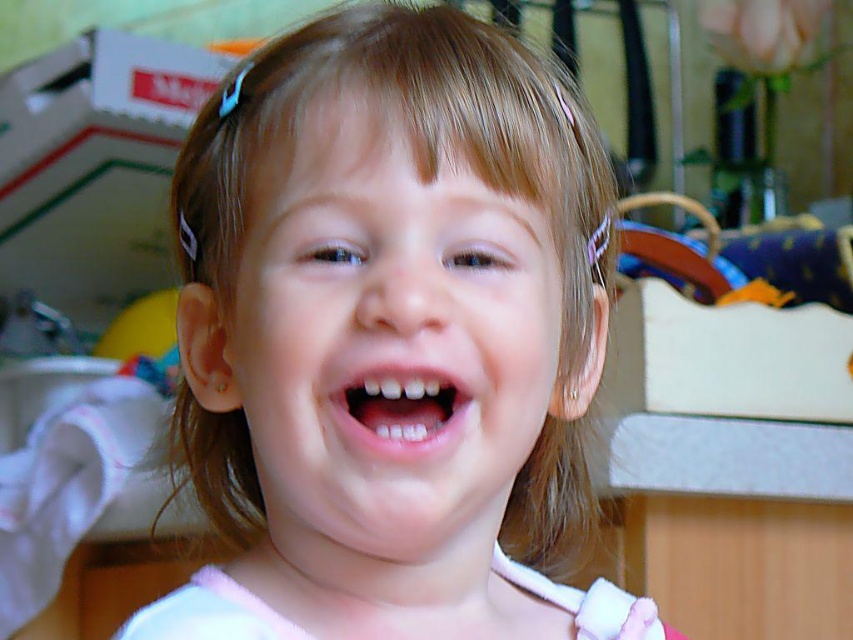
Who is taller, pink fabric at center or pink glossy lips at center?

With more height is pink fabric at center.

Is point (268, 554) farther from camera compared to point (355, 440)?

Yes.

This screenshot has height=640, width=853. I want to click on pink fabric at center, so click(x=390, y=333).